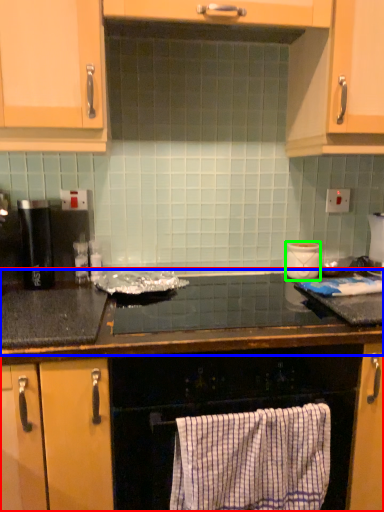
Question: Considering the real-world distances, which object is closest to countertop (highlighted by a red box)? countertop (highlighted by a blue box) or appliance (highlighted by a green box).

Choices:
 (A) countertop
 (B) appliance

Answer: (A)